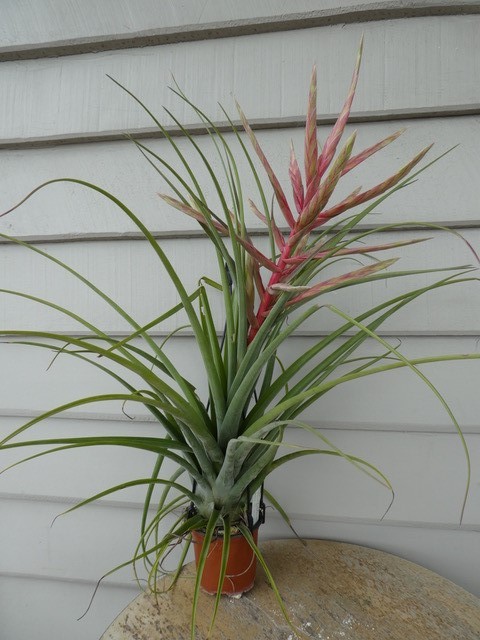
Identify the location of wall. The height and width of the screenshot is (640, 480). (412, 468).